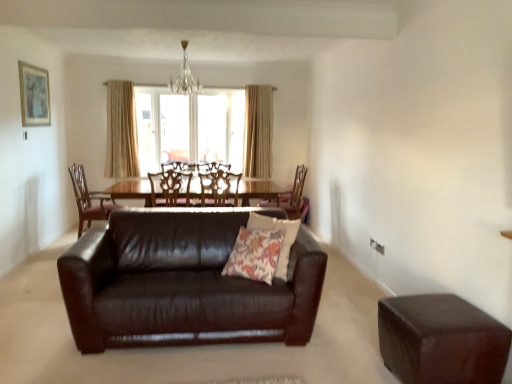
Question: From the image's perspective, is wooden chair at center, the first chair in the right-to-left sequence, on floral fabric pillow at center?

Choices:
 (A) no
 (B) yes

Answer: (B)

Question: Is floral fabric pillow at center located within wooden chair at center, the first chair in the right-to-left sequence?

Choices:
 (A) no
 (B) yes

Answer: (A)

Question: Can you confirm if wooden chair at center, the first chair in the right-to-left sequence, is positioned to the right of floral fabric pillow at center?

Choices:
 (A) yes
 (B) no

Answer: (A)

Question: Is wooden chair at center, the first chair in the right-to-left sequence, facing away from floral fabric pillow at center?

Choices:
 (A) yes
 (B) no

Answer: (B)

Question: Is wooden chair at center, marked as the 4th chair in a left-to-right arrangement, next to floral fabric pillow at center?

Choices:
 (A) no
 (B) yes

Answer: (A)

Question: Is wooden chair at center, the first chair in the right-to-left sequence, further to camera compared to floral fabric pillow at center?

Choices:
 (A) yes
 (B) no

Answer: (A)

Question: Considering the relative positions of beige fabric curtain at upper center, which ranks as the first curtain in right-to-left order, and brown leather ottoman at lower right in the image provided, is beige fabric curtain at upper center, which ranks as the first curtain in right-to-left order, to the right of brown leather ottoman at lower right from the viewer's perspective?

Choices:
 (A) yes
 (B) no

Answer: (B)

Question: Is beige fabric curtain at upper center, which ranks as the first curtain in right-to-left order, further to camera compared to brown leather ottoman at lower right?

Choices:
 (A) yes
 (B) no

Answer: (A)

Question: Is beige fabric curtain at upper center, which ranks as the first curtain in right-to-left order, placed right next to brown leather ottoman at lower right?

Choices:
 (A) yes
 (B) no

Answer: (B)

Question: Does beige fabric curtain at upper center, the second curtain when ordered from left to right, contain brown leather ottoman at lower right?

Choices:
 (A) yes
 (B) no

Answer: (B)

Question: Is beige fabric curtain at upper center, the second curtain when ordered from left to right, thinner than brown leather ottoman at lower right?

Choices:
 (A) no
 (B) yes

Answer: (B)

Question: From the image's perspective, is beige fabric curtain at upper center, which ranks as the first curtain in right-to-left order, over brown leather ottoman at lower right?

Choices:
 (A) no
 (B) yes

Answer: (B)

Question: From the image's perspective, would you say floral fabric pillow at center is shown under beige fabric curtain at upper center, acting as the second curtain starting from the right?

Choices:
 (A) yes
 (B) no

Answer: (A)